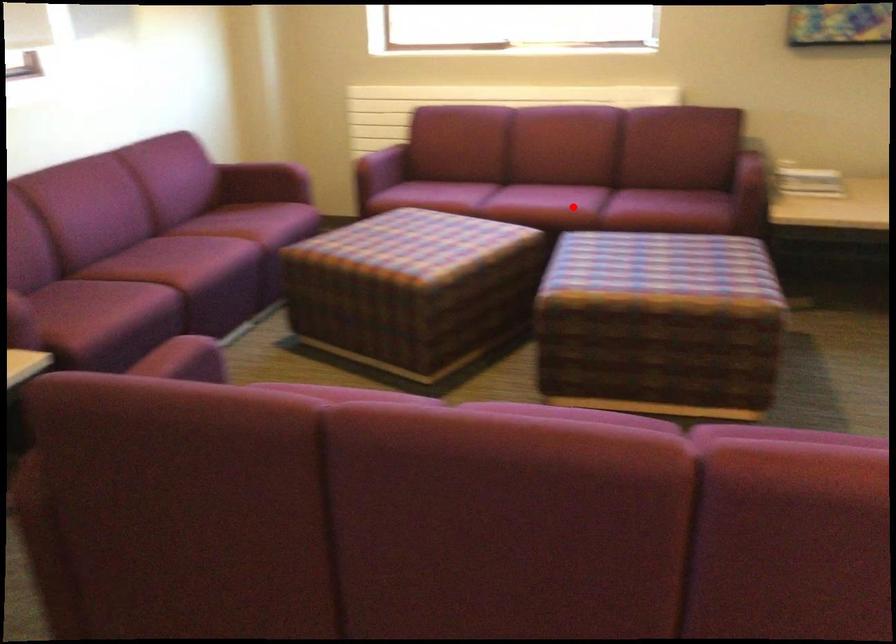
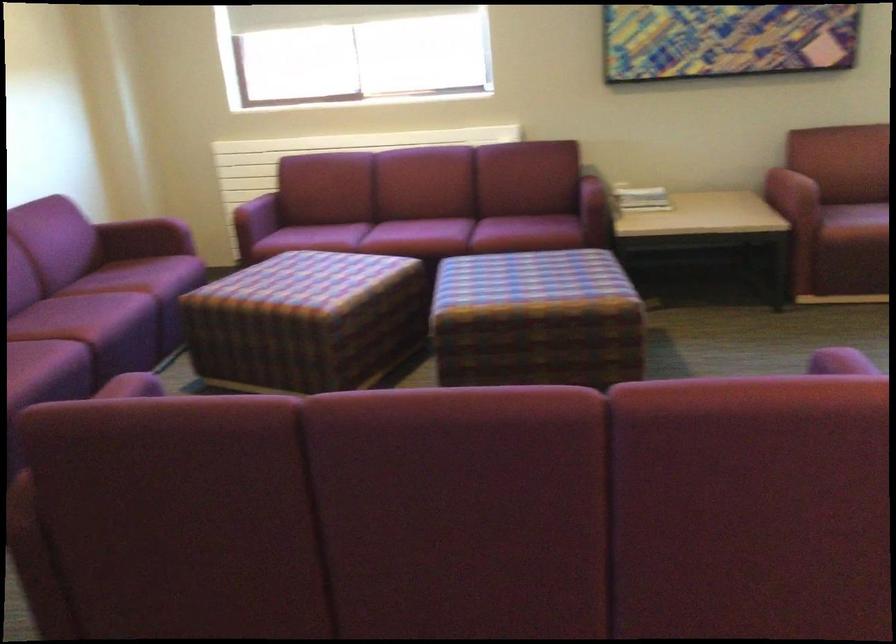
Question: I am providing you with two images of the same scene from different viewpoints. A red point is marked on the first image. At the location where the point appears in image 1, is it still visible in image 2?

Choices:
 (A) Yes
 (B) No

Answer: (A)